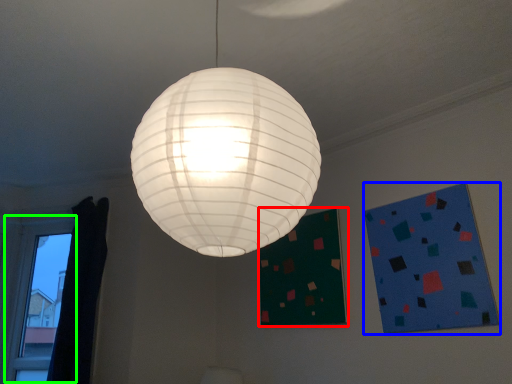
Question: Which is farther away from bulletin board (highlighted by a red box)? design (highlighted by a blue box) or window (highlighted by a green box)?

Choices:
 (A) design
 (B) window

Answer: (B)